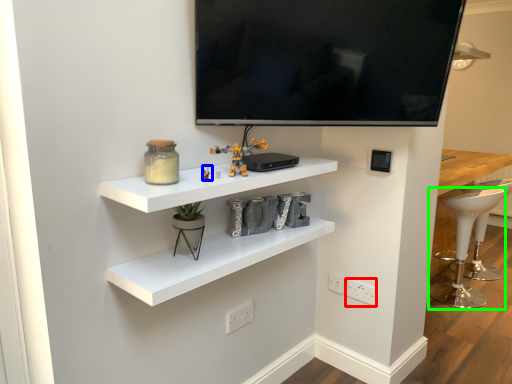
Question: Which is farther away from electric outlet (highlighted by a red box)? toy (highlighted by a blue box) or bar stool (highlighted by a green box)?

Choices:
 (A) toy
 (B) bar stool

Answer: (B)